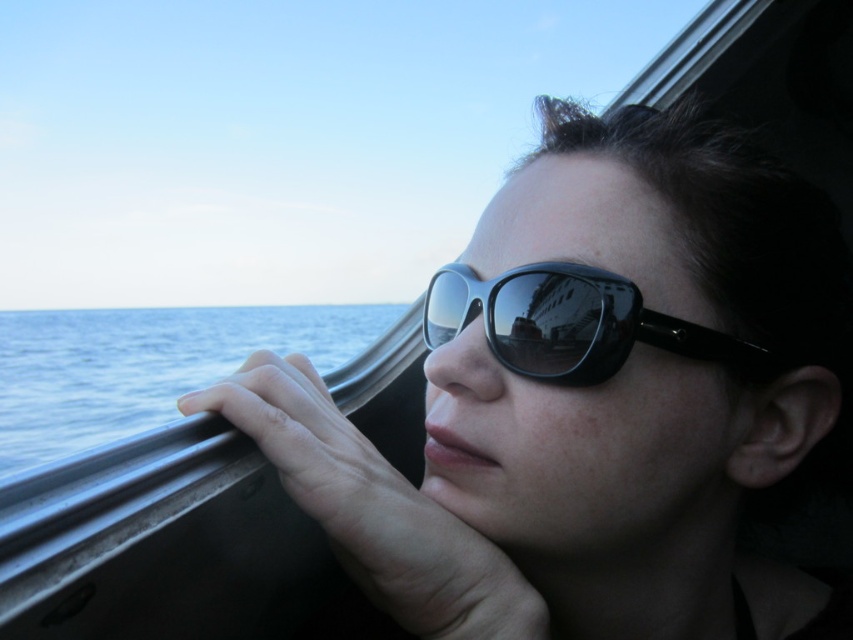
Question: Is blue water at left wider than black shiny sunglasses at center?

Choices:
 (A) no
 (B) yes

Answer: (B)

Question: Does blue water at left have a greater width compared to black shiny sunglasses at center?

Choices:
 (A) no
 (B) yes

Answer: (B)

Question: Which object is farther from the camera taking this photo?

Choices:
 (A) black shiny sunglasses at center
 (B) blue water at left

Answer: (A)

Question: Which point is closer to the camera?

Choices:
 (A) blue water at left
 (B) black shiny sunglasses at center

Answer: (A)

Question: Can you confirm if blue water at left is bigger than black shiny sunglasses at center?

Choices:
 (A) yes
 (B) no

Answer: (A)